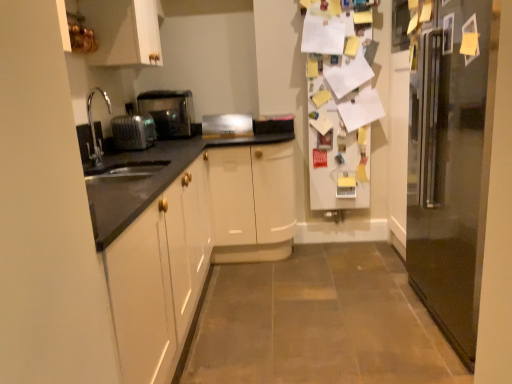
Question: Is satin silver toaster at center, the second appliance positioned from the left, bigger than metallic stainless steel refrigerator at right?

Choices:
 (A) no
 (B) yes

Answer: (A)

Question: Would you say satin silver toaster at center, placed as the first appliance when sorted from right to left, contains metallic stainless steel refrigerator at right?

Choices:
 (A) yes
 (B) no

Answer: (B)

Question: Is satin silver toaster at center, the second appliance viewed from the front, positioned with its back to metallic stainless steel refrigerator at right?

Choices:
 (A) yes
 (B) no

Answer: (B)

Question: Is satin silver toaster at center, the 1th appliance from the back, at the right side of metallic stainless steel refrigerator at right?

Choices:
 (A) no
 (B) yes

Answer: (A)

Question: Is satin silver toaster at center, the second appliance viewed from the front, thinner than metallic stainless steel refrigerator at right?

Choices:
 (A) yes
 (B) no

Answer: (A)

Question: Considering the positions of satin silver toaster at center, the second appliance viewed from the front, and white glossy cabinet at upper left in the image, is satin silver toaster at center, the second appliance viewed from the front, taller or shorter than white glossy cabinet at upper left?

Choices:
 (A) short
 (B) tall

Answer: (A)

Question: Considering the relative positions of satin silver toaster at center, the second appliance viewed from the front, and white glossy cabinet at upper left in the image provided, is satin silver toaster at center, the second appliance viewed from the front, to the left or to the right of white glossy cabinet at upper left?

Choices:
 (A) right
 (B) left

Answer: (A)

Question: Looking at the image, does satin silver toaster at center, placed as the first appliance when sorted from right to left, seem bigger or smaller compared to white glossy cabinet at upper left?

Choices:
 (A) big
 (B) small

Answer: (B)

Question: Considering the positions of satin silver toaster at center, the second appliance positioned from the left, and white glossy cabinet at upper left in the image, is satin silver toaster at center, the second appliance positioned from the left, wider or thinner than white glossy cabinet at upper left?

Choices:
 (A) wide
 (B) thin

Answer: (B)

Question: Relative to metallic stainless steel refrigerator at right, is satin silver toaster at left in front or behind?

Choices:
 (A) behind
 (B) front

Answer: (A)

Question: Looking at the image, does satin silver toaster at left seem bigger or smaller compared to metallic stainless steel refrigerator at right?

Choices:
 (A) big
 (B) small

Answer: (B)

Question: Considering the positions of satin silver toaster at left and metallic stainless steel refrigerator at right in the image, is satin silver toaster at left taller or shorter than metallic stainless steel refrigerator at right?

Choices:
 (A) tall
 (B) short

Answer: (B)

Question: From the image's perspective, is satin silver toaster at left located above or below metallic stainless steel refrigerator at right?

Choices:
 (A) above
 (B) below

Answer: (A)

Question: Considering the relative positions of satin silver toaster at left and satin silver toaster at left, the 1th appliance when ordered from front to back, in the image provided, is satin silver toaster at left to the left or to the right of satin silver toaster at left, the 1th appliance when ordered from front to back,?

Choices:
 (A) right
 (B) left

Answer: (A)

Question: Would you say satin silver toaster at left is inside or outside satin silver toaster at left, which is the 1th appliance in left-to-right order?

Choices:
 (A) inside
 (B) outside

Answer: (B)